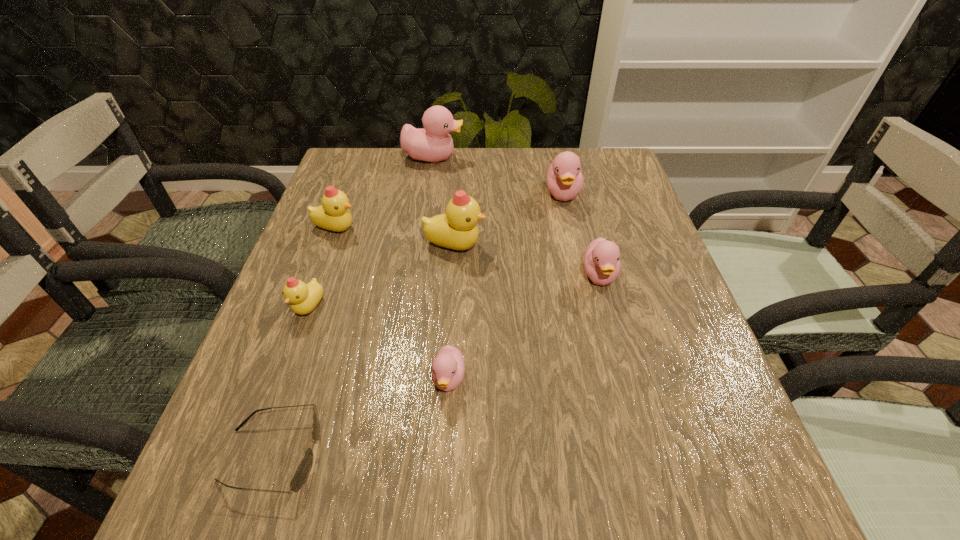
Select which object appears as the fifth closest to the second smallest yellow duckling. Please provide its 2D coordinates. Your answer should be formatted as a tuple, i.e. [(x, y)], where the tuple contains the x and y coordinates of a point satisfying the conditions above.

[(304, 468)]

The width and height of the screenshot is (960, 540). Find the location of `duckling object that ranks as the fifth closest to the second smallest pink duckling`. duckling object that ranks as the fifth closest to the second smallest pink duckling is located at coordinates (334, 215).

Identify the location of the fourth closest duckling to the rightmost yellow duckling. [303, 298].

I want to click on pink duckling that is the third closest one to the second smallest pink duckling, so click(x=434, y=144).

Locate which pink duckling ranks in proximity to the second farthest pink duckling. Please provide its 2D coordinates. Your answer should be formatted as a tuple, i.e. [(x, y)], where the tuple contains the x and y coordinates of a point satisfying the conditions above.

[(602, 263)]

At what (x,y) coordinates should I click in order to perform the action: click on yellow duckling that is the second nearest to the sunglasses. Please return your answer as a coordinate pair (x, y). The image size is (960, 540). Looking at the image, I should click on (457, 229).

Select which yellow duckling appears as the third closest to the second biggest pink duckling. Please provide its 2D coordinates. Your answer should be formatted as a tuple, i.e. [(x, y)], where the tuple contains the x and y coordinates of a point satisfying the conditions above.

[(303, 298)]

This screenshot has height=540, width=960. In order to click on vacant region that satisfies the following two spatial constraints: 1. on the front-facing side of the second shortest object; 2. on the front-facing side of the shortest object in this screenshot , I will do `click(444, 455)`.

Locate an element on the screen. This screenshot has height=540, width=960. vacant point that satisfies the following two spatial constraints: 1. on the front-facing side of the second nearest object; 2. on the front-facing side of the shortest object is located at coordinates (444, 455).

I want to click on free space in the image that satisfies the following two spatial constraints: 1. on the front-facing side of the nearest pink duckling; 2. on the front-facing side of the shortest object, so click(x=444, y=455).